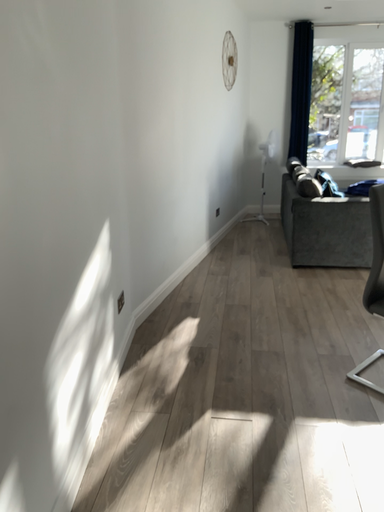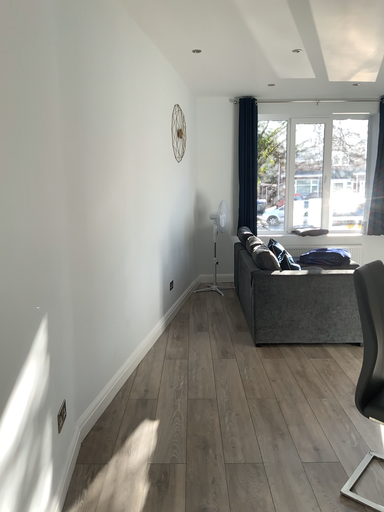
Question: How did the camera likely rotate when shooting the video?

Choices:
 (A) rotated downward
 (B) rotated upward

Answer: (B)